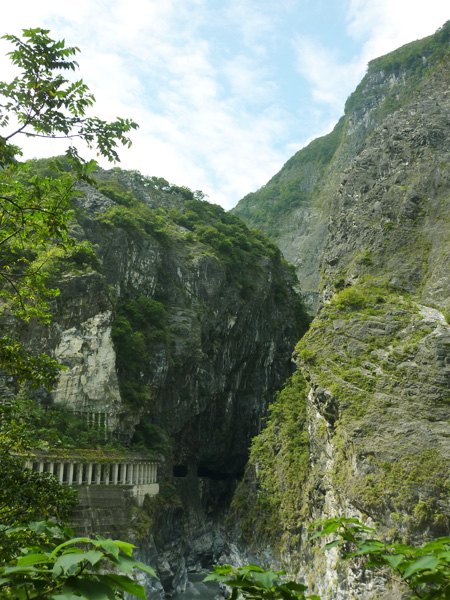
This screenshot has height=600, width=450. I want to click on stairs, so click(x=103, y=524).